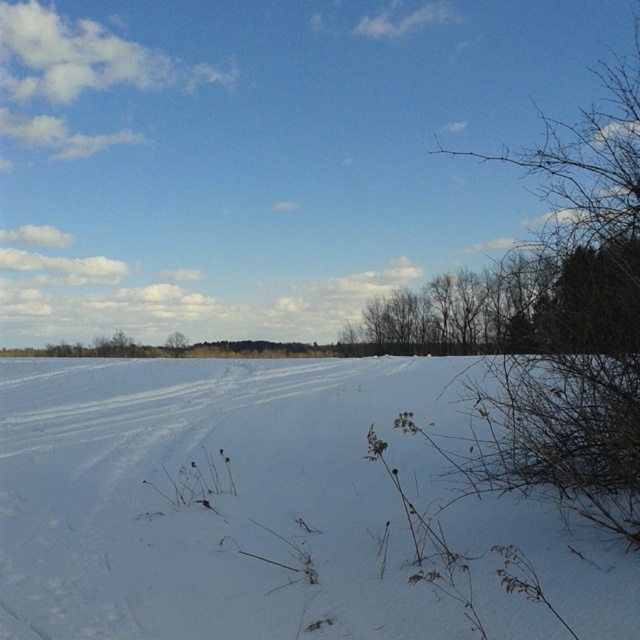
You are an explorer trying to find the safest path across the winter landscape. You notice the white powdery snow at center and the brown bare branches at right. Which area would you avoid walking on to prevent sinking into the snow?

You should avoid walking on the white powdery snow at center because it is thinner than the brown bare branches at right, making it more prone to sinking.

You are standing at the origin point of the image. You want to walk to the white powdery snow at center. Which direction should you go? Please answer with a direction such as north, south, east, west, northeast, etc. or provide a coordinate like x,y. If you can answer with both, do so.

The white powdery snow at center is located at coordinate point (216, 497). Since you are at the origin, you should move towards the northeast direction to reach it. The coordinate is (216, 497).